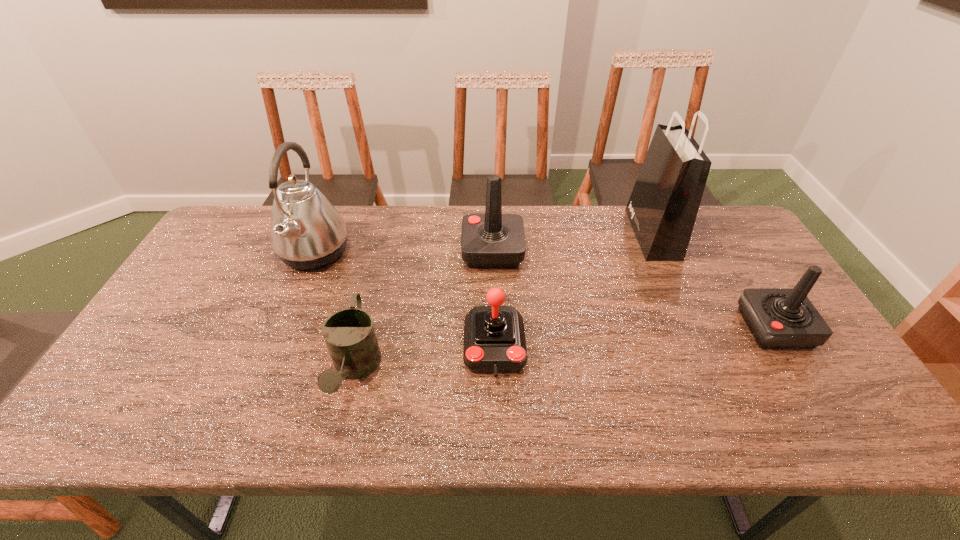
Where is `vacant space situated 0.180m on the front of the kettle`? This screenshot has width=960, height=540. vacant space situated 0.180m on the front of the kettle is located at coordinates (281, 333).

The height and width of the screenshot is (540, 960). In order to click on vacant region located 0.130m on the back of the farthest joystick in this screenshot , I will do tap(492, 210).

This screenshot has height=540, width=960. I want to click on vacant point located on the front-facing side of the rightmost joystick, so click(650, 328).

Locate an element on the screen. vacant space located on the front-facing side of the rightmost joystick is located at coordinates (669, 328).

This screenshot has height=540, width=960. In order to click on free spot located 0.320m on the front-facing side of the rightmost joystick in this screenshot , I will do `click(624, 328)`.

This screenshot has width=960, height=540. In order to click on vacant space positioned on the base of the shortest joystick in this screenshot , I will do [496, 423].

Locate an element on the screen. The image size is (960, 540). shopping bag that is positioned at the far edge is located at coordinates (662, 209).

Identify the location of kettle located in the far edge section of the desktop. The height and width of the screenshot is (540, 960). (306, 231).

You are a GUI agent. You are given a task and a screenshot of the screen. Output one action in this format:
    pyautogui.click(x=<x>, y=<y>)
    Task: Click on the joystick that is at the far edge
    The image size is (960, 540).
    Given the screenshot: What is the action you would take?
    pyautogui.click(x=493, y=240)

This screenshot has width=960, height=540. I want to click on object that is at the near edge, so click(x=349, y=334).